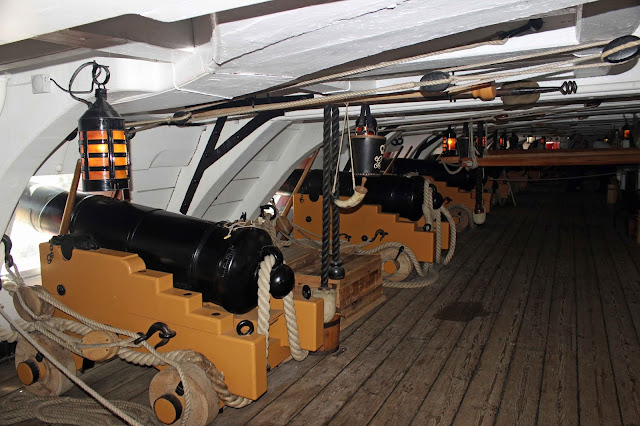
The height and width of the screenshot is (426, 640). Find the location of `beam`. beam is located at coordinates (585, 158).